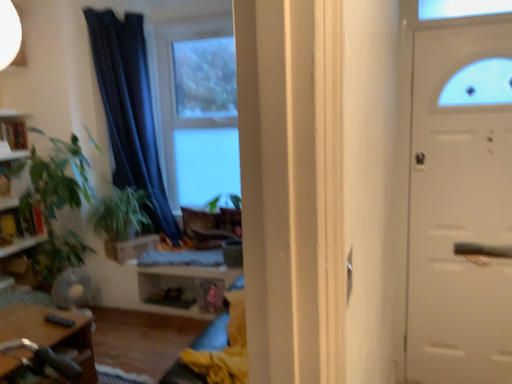
Question: Is green leafy plant at left completely or partially inside wooden bookshelf at left?

Choices:
 (A) yes
 (B) no

Answer: (B)

Question: From the image's perspective, is wooden bookshelf at left beneath green leafy plant at left?

Choices:
 (A) no
 (B) yes

Answer: (A)

Question: Does wooden bookshelf at left have a smaller size compared to green leafy plant at left?

Choices:
 (A) yes
 (B) no

Answer: (A)

Question: Is wooden bookshelf at left turned away from green leafy plant at left?

Choices:
 (A) yes
 (B) no

Answer: (B)

Question: Considering the relative sizes of wooden bookshelf at left and green leafy plant at left in the image provided, is wooden bookshelf at left taller than green leafy plant at left?

Choices:
 (A) yes
 (B) no

Answer: (B)

Question: Does wooden bookshelf at left lie in front of green leafy plant at left?

Choices:
 (A) no
 (B) yes

Answer: (A)

Question: From the image's perspective, would you say clear glass window at center is shown under green leafy plant at left?

Choices:
 (A) yes
 (B) no

Answer: (B)

Question: Is clear glass window at center bigger than green leafy plant at left?

Choices:
 (A) no
 (B) yes

Answer: (A)

Question: From a real-world perspective, is clear glass window at center located beneath green leafy plant at left?

Choices:
 (A) yes
 (B) no

Answer: (B)

Question: Are clear glass window at center and green leafy plant at left far apart?

Choices:
 (A) no
 (B) yes

Answer: (B)

Question: From a real-world perspective, is clear glass window at center over green leafy plant at left?

Choices:
 (A) no
 (B) yes

Answer: (B)

Question: Are clear glass window at center and green leafy plant at left making contact?

Choices:
 (A) yes
 (B) no

Answer: (B)

Question: Does green leafy plant at left have a greater width compared to dark blue fabric curtain at center?

Choices:
 (A) no
 (B) yes

Answer: (B)